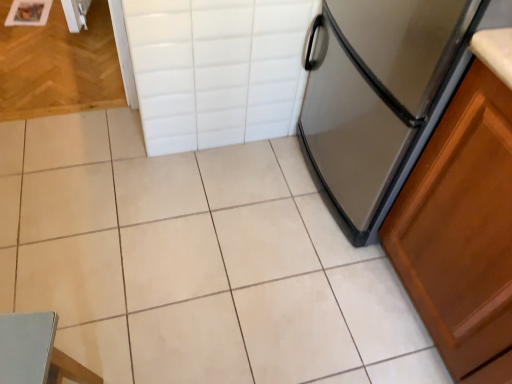
The width and height of the screenshot is (512, 384). I want to click on free space between satin silver refrigerator at right and light blue fabric chair at lower left, so click(230, 269).